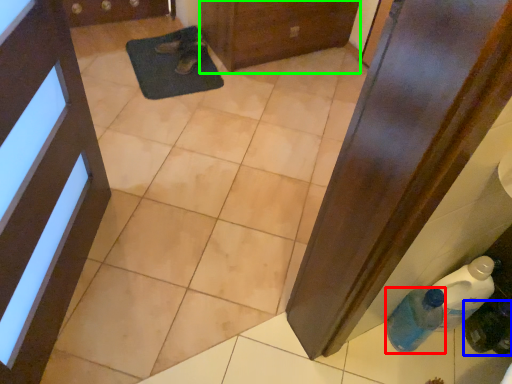
Question: Based on their relative distances, which object is nearer to bottle (highlighted by a red box)? Choose from bottle (highlighted by a blue box) and door (highlighted by a green box).

Choices:
 (A) bottle
 (B) door

Answer: (A)